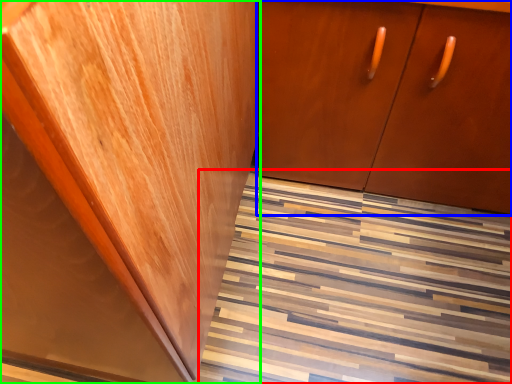
Question: Which is farther away from stairwell (highlighted by a red box)? cabinetry (highlighted by a blue box) or cabinetry (highlighted by a green box)?

Choices:
 (A) cabinetry
 (B) cabinetry

Answer: (B)